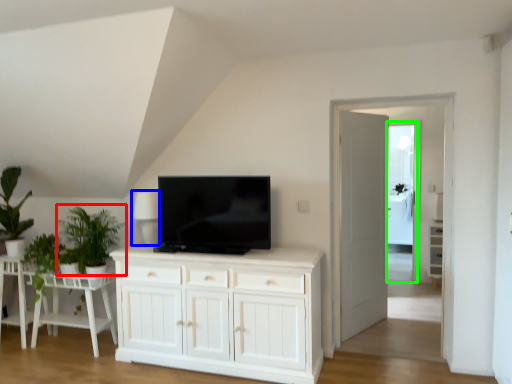
Question: Which object is the farthest from plant (highlighted by a red box)? Choose among these: lamp (highlighted by a blue box) or glass door (highlighted by a green box).

Choices:
 (A) lamp
 (B) glass door

Answer: (B)